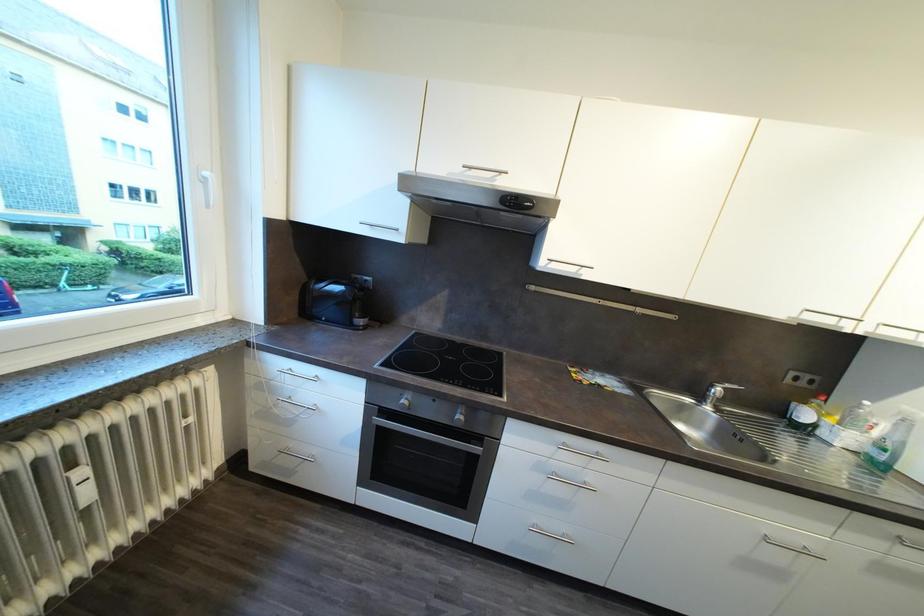
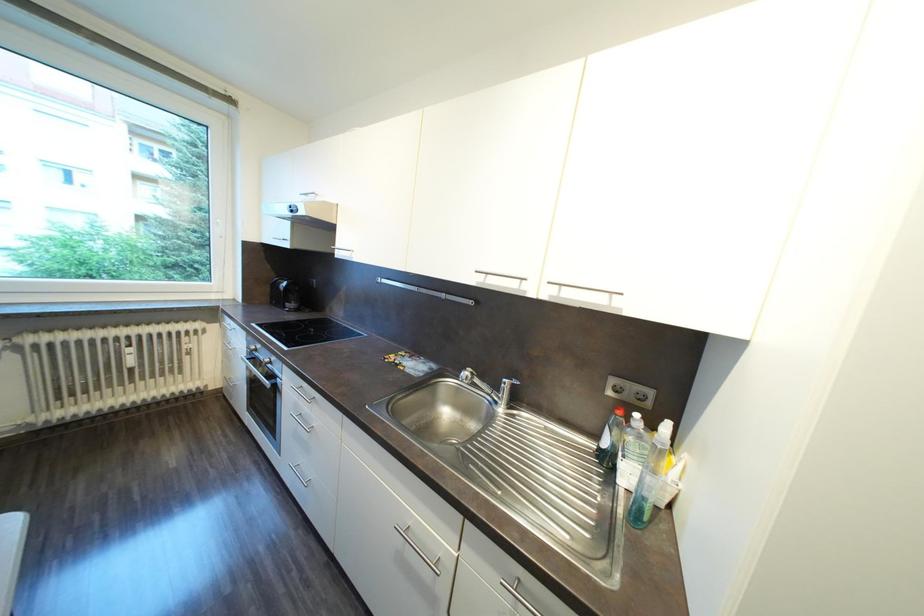
Question: In a continuous first-person perspective shot, in which direction is the camera moving?

Choices:
 (A) Left
 (B) Right
 (C) Forward
 (D) Backward

Answer: (B)